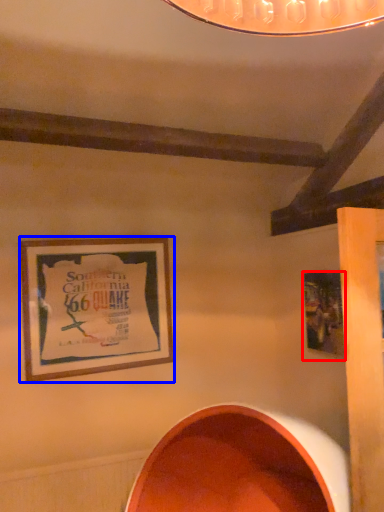
Question: Which object appears farthest to the camera in this image, picture frame (highlighted by a red box) or picture frame (highlighted by a blue box)?

Choices:
 (A) picture frame
 (B) picture frame

Answer: (B)